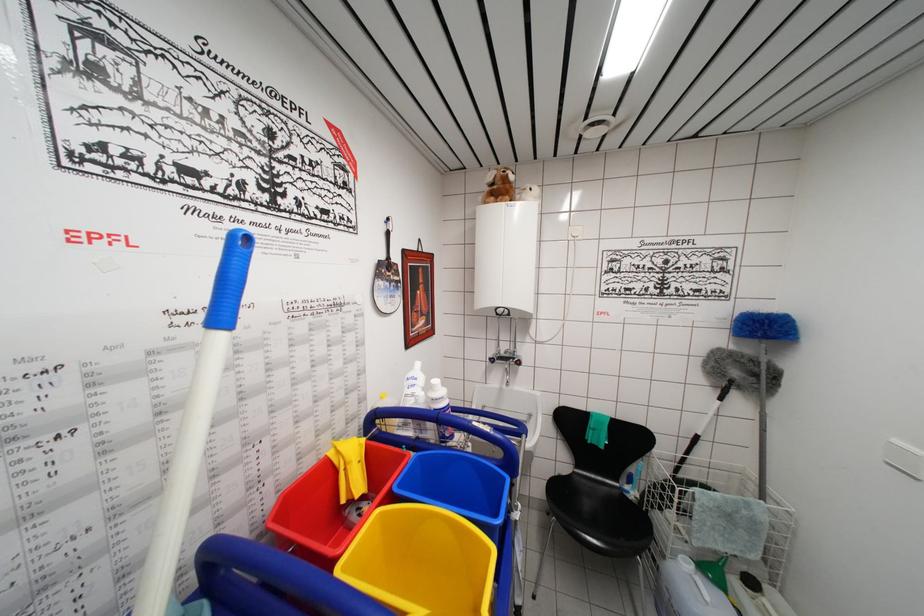
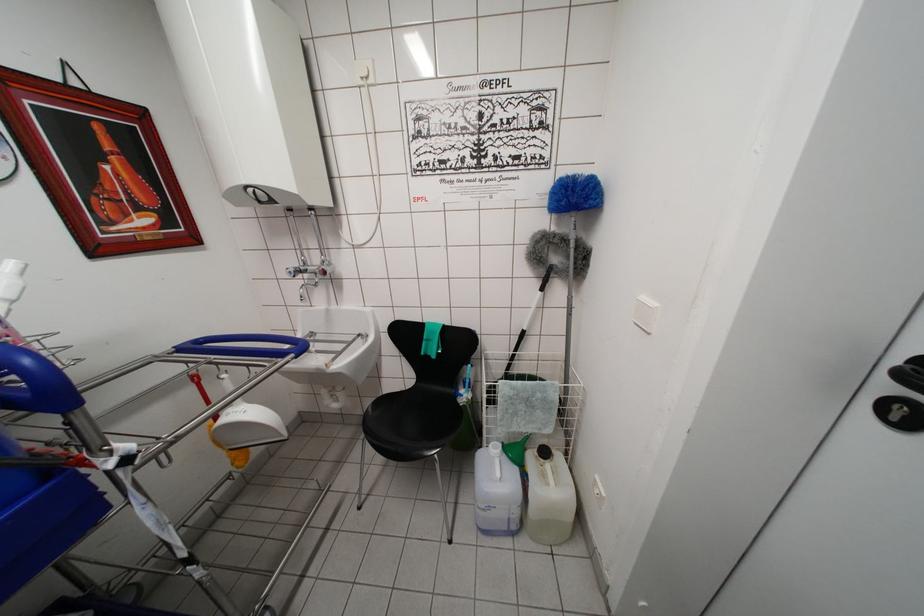
Where in the second image is the point corresponding to the point at 690,458 from the first image?

(518, 354)